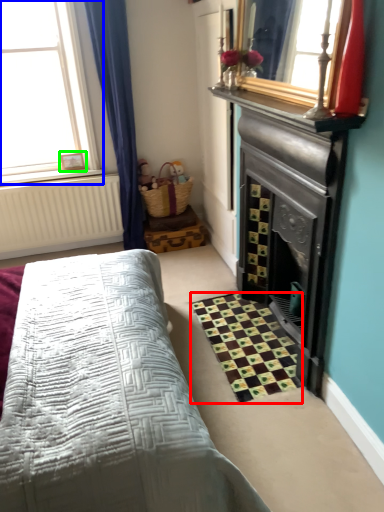
Question: Which object is positioned closest to pattern (highlighted by a red box)? Select from window (highlighted by a blue box) and picture frame (highlighted by a green box).

Choices:
 (A) window
 (B) picture frame

Answer: (B)